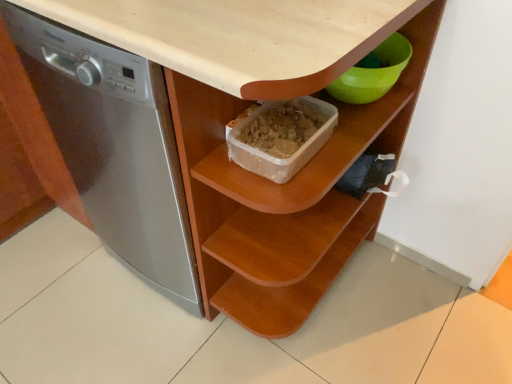
This screenshot has height=384, width=512. Describe the element at coordinates (307, 163) in the screenshot. I see `wooden container at center` at that location.

In the scene shown: In order to face wooden container at center, should I rotate leftwards or rightwards?

Turn right by 13.446 degrees to look at wooden container at center.

At what (x,y) coordinates should I click in order to perform the action: click on wooden container at center. Please return your answer as a coordinate pair (x, y). This screenshot has width=512, height=384. Looking at the image, I should click on (307, 163).

Locate an element on the screen. satin silver dishwasher at left is located at coordinates (114, 147).

The image size is (512, 384). Describe the element at coordinates (114, 147) in the screenshot. I see `satin silver dishwasher at left` at that location.

Locate an element on the screen. The width and height of the screenshot is (512, 384). wooden container at center is located at coordinates (307, 163).

Considering the relative positions of satin silver dishwasher at left and wooden container at center in the image provided, is satin silver dishwasher at left to the left of wooden container at center from the viewer's perspective?

Result: Correct, you'll find satin silver dishwasher at left to the left of wooden container at center.

Considering the positions of objects satin silver dishwasher at left and wooden container at center in the image provided, who is in front, satin silver dishwasher at left or wooden container at center?

satin silver dishwasher at left is in front.

Considering the points (122, 189) and (370, 117), which point is behind, point (122, 189) or point (370, 117)?

The point (122, 189) is farther from the camera.

From the image's perspective, which is below, satin silver dishwasher at left or wooden container at center?

From the image's view, wooden container at center is below.

From a real-world perspective, is satin silver dishwasher at left physically located above or below wooden container at center?

satin silver dishwasher at left is above wooden container at center.

Does satin silver dishwasher at left have a lesser width compared to wooden container at center?

Incorrect, the width of satin silver dishwasher at left is not less than that of wooden container at center.

Is satin silver dishwasher at left shorter than wooden container at center?

No, satin silver dishwasher at left is not shorter than wooden container at center.

Looking at this image, considering the sizes of objects satin silver dishwasher at left and wooden container at center in the image provided, who is bigger, satin silver dishwasher at left or wooden container at center?

satin silver dishwasher at left.

Is wooden container at center inside satin silver dishwasher at left?

No, wooden container at center is not surrounded by satin silver dishwasher at left.

Is satin silver dishwasher at left positioned far away from wooden container at center?

No.

Is satin silver dishwasher at left aimed at wooden container at center?

No, satin silver dishwasher at left is not facing towards wooden container at center.

Where is `home appliance in front of the wooden container at center`? The width and height of the screenshot is (512, 384). home appliance in front of the wooden container at center is located at coordinates (114, 147).

Is wooden container at center to the right of satin silver dishwasher at left from the viewer's perspective?

Indeed, wooden container at center is positioned on the right side of satin silver dishwasher at left.

Which object is further away from the camera, wooden container at center or satin silver dishwasher at left?

wooden container at center is further away from the camera.

Which is further, (227, 186) or (130, 253)?

Positioned behind is point (130, 253).

From the image's perspective, does wooden container at center appear higher than satin silver dishwasher at left?

Actually, wooden container at center appears below satin silver dishwasher at left in the image.

From a real-world perspective, is wooden container at center on top of satin silver dishwasher at left?

No, from a real-world perspective, wooden container at center is not above satin silver dishwasher at left.

Considering the relative sizes of wooden container at center and satin silver dishwasher at left in the image provided, is wooden container at center thinner than satin silver dishwasher at left?

Correct, the width of wooden container at center is less than that of satin silver dishwasher at left.

Can you confirm if wooden container at center is taller than satin silver dishwasher at left?

Incorrect, the height of wooden container at center is not larger of that of satin silver dishwasher at left.

Considering the sizes of objects wooden container at center and satin silver dishwasher at left in the image provided, who is bigger, wooden container at center or satin silver dishwasher at left?

With larger size is satin silver dishwasher at left.

Do you think wooden container at center is within satin silver dishwasher at left, or outside of it?

wooden container at center is located beyond the bounds of satin silver dishwasher at left.

Are wooden container at center and satin silver dishwasher at left making contact?

No, wooden container at center is not with satin silver dishwasher at left.

Is satin silver dishwasher at left at the back of wooden container at center?

Yes, satin silver dishwasher at left is at the back of wooden container at center.

Image resolution: width=512 pixels, height=384 pixels. What are the coordinates of `home appliance lying above the wooden container at center (from the image's perspective)` in the screenshot? It's located at (114, 147).

This screenshot has height=384, width=512. I want to click on home appliance that appears above the wooden container at center (from the image's perspective), so click(114, 147).

You are a GUI agent. You are given a task and a screenshot of the screen. Output one action in this format:
    pyautogui.click(x=<x>, y=<y>)
    Task: Click on the home appliance lying on the left of wooden container at center
    
    Given the screenshot: What is the action you would take?
    pyautogui.click(x=114, y=147)